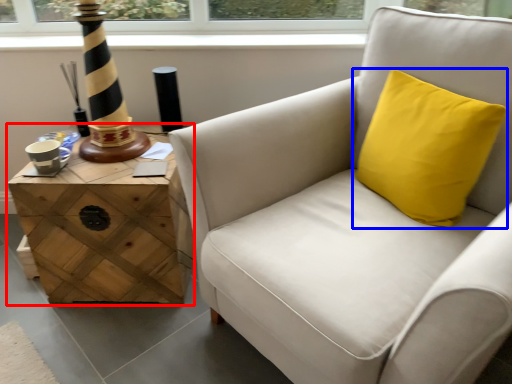
Question: Which of the following is the farthest to the observer, table (highlighted by a red box) or pillow (highlighted by a blue box)?

Choices:
 (A) table
 (B) pillow

Answer: (A)